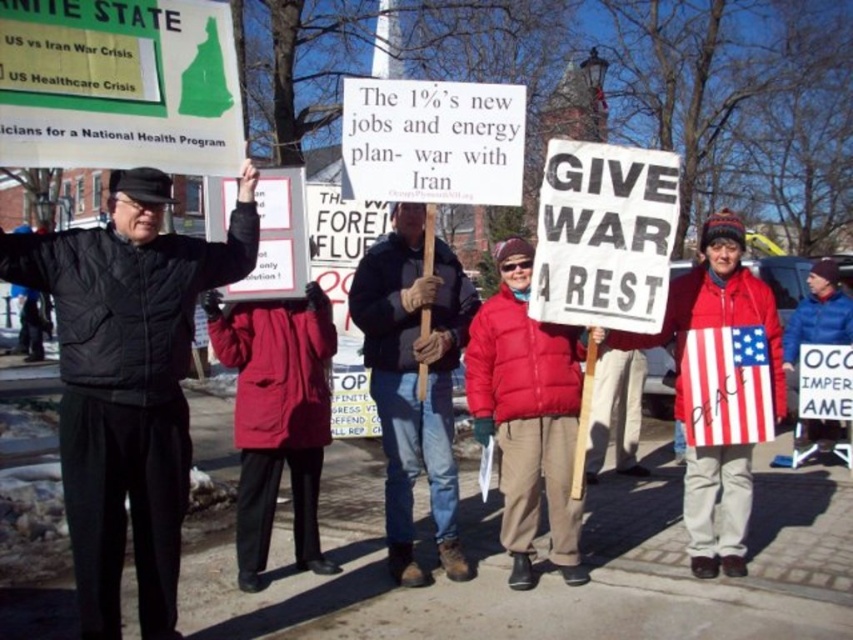
Which is below, dark blue jacket at center or american flag at center?

Positioned lower is dark blue jacket at center.

Is dark blue jacket at center to the right of american flag at center from the viewer's perspective?

Incorrect, dark blue jacket at center is not on the right side of american flag at center.

Which is in front, point (370, 364) or point (747, 422)?

Positioned in front is point (747, 422).

The width and height of the screenshot is (853, 640). Find the location of `dark blue jacket at center`. dark blue jacket at center is located at coordinates pos(413,380).

Is point (213, 253) farther from camera compared to point (459, 353)?

No.

Is black matte jacket at left positioned in front of dark blue jacket at center?

Yes.

This screenshot has height=640, width=853. In order to click on black matte jacket at left in this screenshot , I will do `click(128, 381)`.

Locate an element on the screen. black matte jacket at left is located at coordinates (128, 381).

Which is behind, point (167, 285) or point (682, 352)?

Positioned behind is point (682, 352).

Does black matte jacket at left have a greater width compared to american flag at center?

Indeed, black matte jacket at left has a greater width compared to american flag at center.

The width and height of the screenshot is (853, 640). Identify the location of black matte jacket at left. (x=128, y=381).